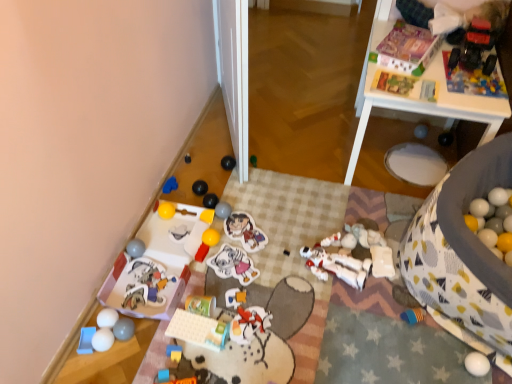
Identify the location of vacant region to the right of white matte doll at center, acting as the 5th toy starting from the right. The image size is (512, 384). (391, 271).